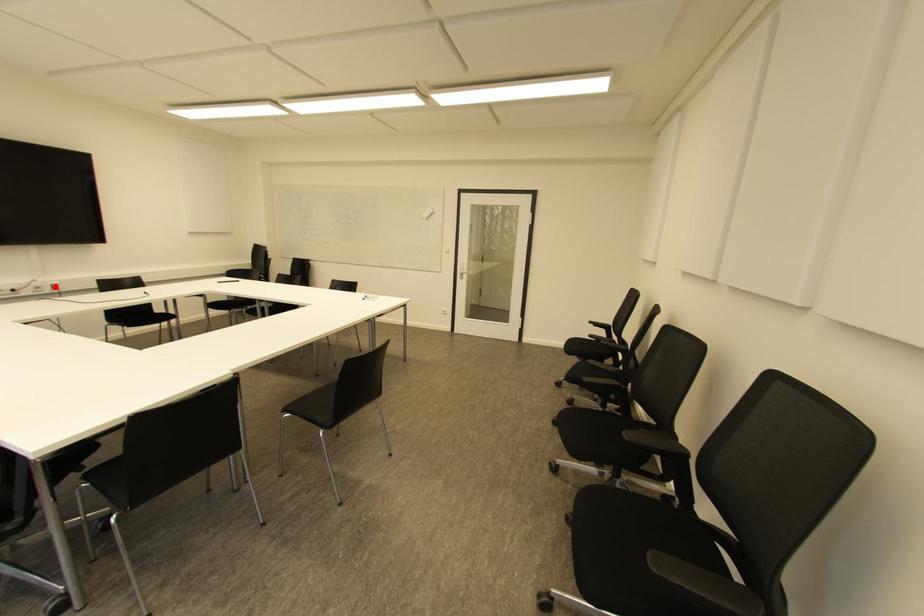
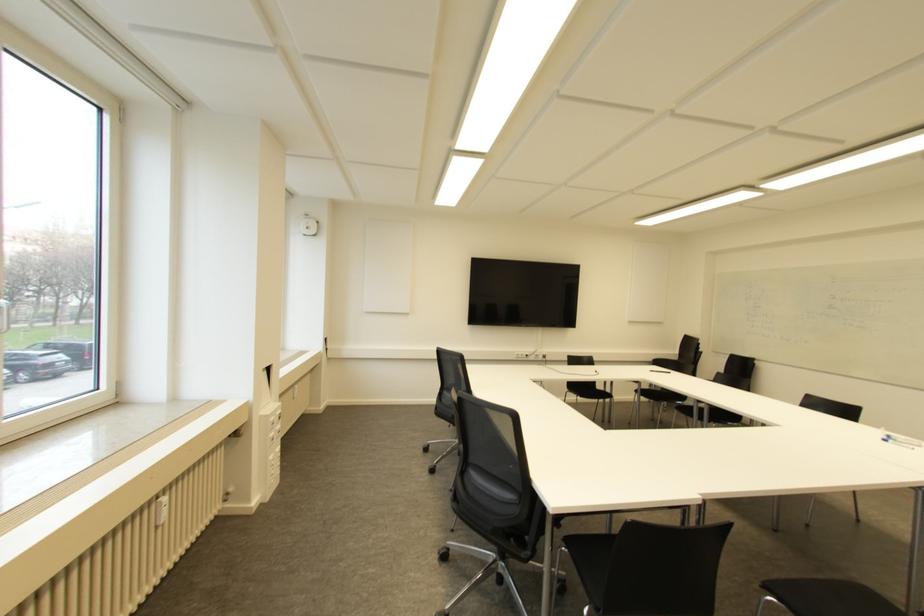
Question: I am providing you with two images of the same scene from different viewpoints. Given a red point in image1, look at the same physical point in image2. Is it:

Choices:
 (A) Closer to the viewpoint
 (B) Farther from the viewpoint

Answer: (B)